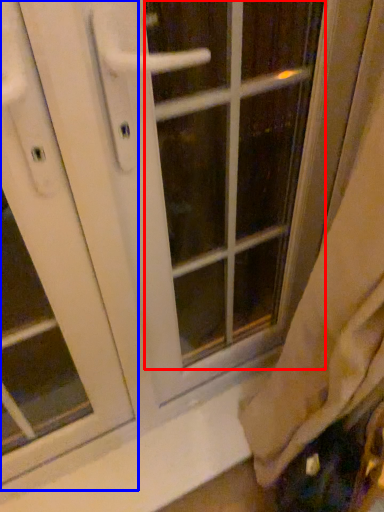
Question: Which object is closer to the camera taking this photo, glass door (highlighted by a red box) or screen door (highlighted by a blue box)?

Choices:
 (A) glass door
 (B) screen door

Answer: (B)